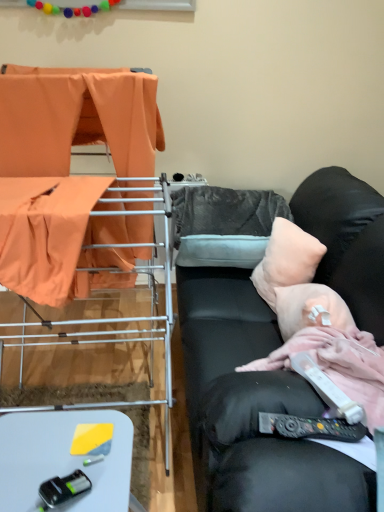
You are a GUI agent. You are given a task and a screenshot of the screen. Output one action in this format:
    pyautogui.click(x=<x>, y=<y>)
    Task: Click on the peachy soft pillow at right, the 1th pillow from the front
    Image resolution: width=384 pixels, height=512 pixels.
    Given the screenshot: What is the action you would take?
    pyautogui.click(x=286, y=260)

This screenshot has height=512, width=384. Find the location of `black plastic toy car at lower left, the 1th equipment ordered from the bottom`. black plastic toy car at lower left, the 1th equipment ordered from the bottom is located at coordinates (63, 489).

In order to face gray fuzzy pillow at center, which is the 1th pillow in back-to-front order, should I rotate leftwards or rightwards?

A 4.480 degree turn to the right will do.

Describe the element at coordinates (224, 225) in the screenshot. This screenshot has width=384, height=512. I see `gray fuzzy pillow at center, the second pillow in the front-to-back sequence` at that location.

What do you see at coordinates (310, 426) in the screenshot?
I see `black plastic remote control at lower right` at bounding box center [310, 426].

Find the location of a particular element. black plastic remote control at lower right is located at coordinates (310, 426).

Image resolution: width=384 pixels, height=512 pixels. Describe the element at coordinates (328, 391) in the screenshot. I see `white plastic remote control at lower right, which appears as the 1th equipment when viewed from the top` at that location.

This screenshot has height=512, width=384. Describe the element at coordinates (251, 408) in the screenshot. I see `black leather couch at right` at that location.

You are a GUI agent. You are given a task and a screenshot of the screen. Output one action in this format:
    pyautogui.click(x=<x>, y=<y>)
    Task: Click on the peachy soft pillow at right, the 1th pillow from the front
    
    Given the screenshot: What is the action you would take?
    coord(286,260)

How many degrees apart are the facing directions of black plastic remote control at lower right and white plastic table at lower left?

They differ by 10.8 degrees in their facing directions.

Could you tell me if black plastic remote control at lower right is facing white plastic table at lower left?

No, black plastic remote control at lower right does not turn towards white plastic table at lower left.

Between point (305, 429) and point (21, 489), which one is positioned in front?

The point (305, 429) is closer to the camera.

The image size is (384, 512). Find the location of `table in front of the black plastic remote control at lower right`. table in front of the black plastic remote control at lower right is located at coordinates (62, 459).

In terms of width, does gray fuzzy pillow at center, the second pillow in the front-to-back sequence, look wider or thinner when compared to black plastic remote control at lower right?

Considering their sizes, gray fuzzy pillow at center, the second pillow in the front-to-back sequence, looks broader than black plastic remote control at lower right.

Is gray fuzzy pillow at center, which is the 1th pillow in back-to-front order, far away from black plastic remote control at lower right?

Yes, gray fuzzy pillow at center, which is the 1th pillow in back-to-front order, and black plastic remote control at lower right are located far from each other.

Which object is closer to the camera, gray fuzzy pillow at center, the second pillow in the front-to-back sequence, or black plastic remote control at lower right?

black plastic remote control at lower right.

Is point (248, 254) more distant than point (298, 428)?

That is True.

Is peachy soft pillow at right, the 1th pillow from the front, to the right of pink fabric at right from the viewer's perspective?

Indeed, peachy soft pillow at right, the 1th pillow from the front, is positioned on the right side of pink fabric at right.

Find the location of a particular element. pillow on the right side of pink fabric at right is located at coordinates pos(286,260).

From the image's perspective, who appears lower, peachy soft pillow at right, the 1th pillow from the front, or pink fabric at right?

pink fabric at right, from the image's perspective.

Can you tell me how much peachy soft pillow at right, the 1th pillow from the front, and pink fabric at right differ in facing direction?

peachy soft pillow at right, the 1th pillow from the front, and pink fabric at right are facing 18.7 degrees away from each other.

Considering the positions of point (329, 326) and point (323, 392), is point (329, 326) closer or farther from the camera than point (323, 392)?

Clearly, point (329, 326) is more distant from the camera than point (323, 392).

Does pink fabric at right have a greater width compared to white plastic remote control at lower right, which is the second equipment in left-to-right order?

Indeed, pink fabric at right has a greater width compared to white plastic remote control at lower right, which is the second equipment in left-to-right order.

Is pink fabric at right at the left side of white plastic remote control at lower right, which is the second equipment in left-to-right order?

Incorrect, pink fabric at right is not on the left side of white plastic remote control at lower right, which is the second equipment in left-to-right order.

From the image's perspective, between pink fabric at right and white plastic remote control at lower right, the 2th equipment in the bottom-to-top sequence, which one is located above?

pink fabric at right, from the image's perspective.

From a real-world perspective, does white plastic remote control at lower right, which appears as the 1th equipment when viewed from the top, sit lower than metal drying rack at left, which ranks as the 1th furniture in front-to-back order?

Correct, in the physical world, white plastic remote control at lower right, which appears as the 1th equipment when viewed from the top, is lower than metal drying rack at left, which ranks as the 1th furniture in front-to-back order.

Which point is more forward, (315, 383) or (36, 331)?

Point (315, 383)

Is white plastic remote control at lower right, which appears as the 1th equipment when viewed from the top, wider than metal drying rack at left, the 2th furniture from the back?

No, white plastic remote control at lower right, which appears as the 1th equipment when viewed from the top, is not wider than metal drying rack at left, the 2th furniture from the back.

Considering the positions of objects black plastic toy car at lower left, which is the 1th equipment in left-to-right order, and pink fabric at right in the image provided, who is more to the right, black plastic toy car at lower left, which is the 1th equipment in left-to-right order, or pink fabric at right?

pink fabric at right.

Is black plastic toy car at lower left, acting as the 2th equipment starting from the top, positioned in front of pink fabric at right?

Yes.

Is black plastic toy car at lower left, which is the 1th equipment in left-to-right order, looking in the opposite direction of pink fabric at right?

Yes, pink fabric at right is at the back of black plastic toy car at lower left, which is the 1th equipment in left-to-right order.

How different are the orientations of black plastic toy car at lower left, acting as the 2th equipment starting from the top, and pink fabric at right in degrees?

They differ by 42 degrees in their facing directions.

Which of these two, gray fuzzy pillow at center, the second pillow in the front-to-back sequence, or white plastic table at lower left, is wider?

gray fuzzy pillow at center, the second pillow in the front-to-back sequence.

In terms of height, does gray fuzzy pillow at center, the second pillow in the front-to-back sequence, look taller or shorter compared to white plastic table at lower left?

In the image, gray fuzzy pillow at center, the second pillow in the front-to-back sequence, appears to be shorter than white plastic table at lower left.

You are a GUI agent. You are given a task and a screenshot of the screen. Output one action in this format:
    pyautogui.click(x=<x>, y=<y>)
    Task: Click on the table that appears below the gray fuzzy pillow at center, the second pillow in the front-to-back sequence (from the image's perspective)
    The width and height of the screenshot is (384, 512).
    Given the screenshot: What is the action you would take?
    pyautogui.click(x=62, y=459)

Could you tell me if gray fuzzy pillow at center, which is the 1th pillow in back-to-front order, is turned towards white plastic table at lower left?

No, gray fuzzy pillow at center, which is the 1th pillow in back-to-front order, is not aimed at white plastic table at lower left.

Locate an element on the screen. remote control that is on the right side of white plastic table at lower left is located at coordinates (310, 426).

Locate an element on the screen. pillow that is the 2nd object located behind the black plastic remote control at lower right is located at coordinates coord(224,225).

Considering their positions, is orange fabric at left, marked as the second furniture in a front-to-back arrangement, positioned closer to peachy soft pillow at right, the 1th pillow from the front, than pink fabric at right?

pink fabric at right lies closer to peachy soft pillow at right, the 1th pillow from the front, than the other object.

Based on their spatial positions, is black leather couch at right or black plastic toy car at lower left, which is the 1th equipment in left-to-right order, closer to orange fabric at left, marked as the second furniture in a front-to-back arrangement?

black leather couch at right lies closer to orange fabric at left, marked as the second furniture in a front-to-back arrangement, than the other object.

Based on their spatial positions, is orange fabric at left, the first furniture when ordered from back to front, or white plastic remote control at lower right, the 2th equipment in the bottom-to-top sequence, closer to pink fabric at right?

white plastic remote control at lower right, the 2th equipment in the bottom-to-top sequence.

Looking at the image, which one is located closer to black leather couch at right, gray fuzzy pillow at center, which is the 1th pillow in back-to-front order, or pink fabric at right?

pink fabric at right.

From the image, which object appears to be nearer to orange fabric at left, the first furniture when ordered from back to front, white plastic remote control at lower right, which is the second equipment in left-to-right order, or white plastic table at lower left?

white plastic table at lower left is positioned closer to the anchor orange fabric at left, the first furniture when ordered from back to front.

Looking at the image, which one is located further to orange fabric at left, the first furniture when ordered from back to front, gray fuzzy pillow at center, the second pillow in the front-to-back sequence, or pink fabric at right?

Based on the image, pink fabric at right appears to be further to orange fabric at left, the first furniture when ordered from back to front.

Considering their positions, is black plastic remote control at lower right positioned closer to white plastic table at lower left than white plastic remote control at lower right, which is the second equipment in left-to-right order?

Based on the image, black plastic remote control at lower right appears to be nearer to white plastic table at lower left.

Which object lies nearer to the anchor point white plastic remote control at lower right, which is the first equipment in right-to-left order, pink fabric at right or black plastic toy car at lower left, the 1th equipment ordered from the bottom?

Among the two, pink fabric at right is located nearer to white plastic remote control at lower right, which is the first equipment in right-to-left order.

Locate an element on the screen. The image size is (384, 512). remote control between black plastic toy car at lower left, the second equipment viewed from the right, and gray fuzzy pillow at center, which is the 1th pillow in back-to-front order, along the z-axis is located at coordinates (310, 426).

This screenshot has width=384, height=512. What are the coordinates of `studio couch between metal drying rack at left, which ranks as the 1th furniture in front-to-back order, and peachy soft pillow at right, the 1th pillow from the front, in the horizontal direction` in the screenshot? It's located at (251, 408).

The width and height of the screenshot is (384, 512). I want to click on person between black leather couch at right and peachy soft pillow at right, the 1th pillow from the front, along the z-axis, so click(x=328, y=345).

Where is `remote control between metal drying rack at left, the 2th furniture from the back, and white plastic remote control at lower right, the 2th equipment in the bottom-to-top sequence, from left to right`? This screenshot has width=384, height=512. remote control between metal drying rack at left, the 2th furniture from the back, and white plastic remote control at lower right, the 2th equipment in the bottom-to-top sequence, from left to right is located at coordinates (310, 426).